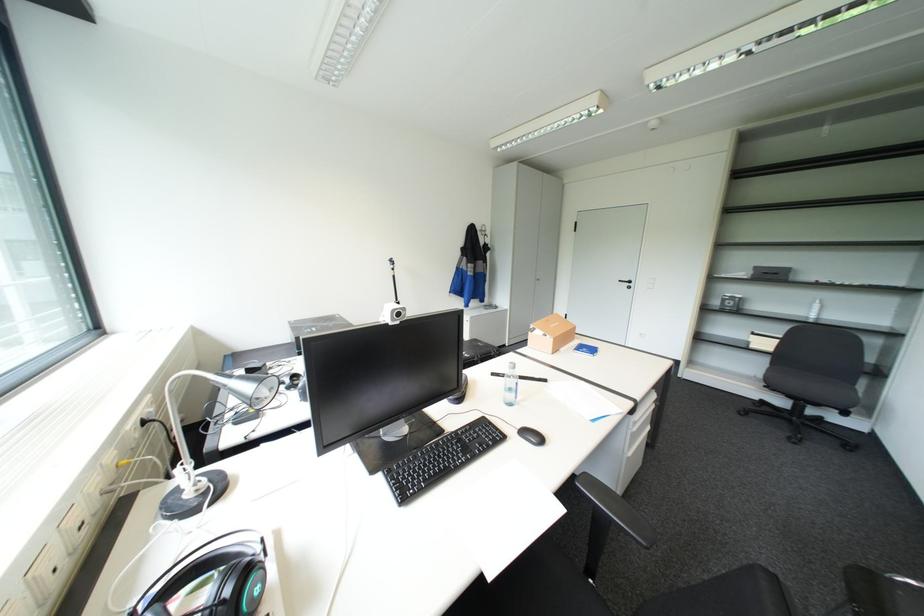
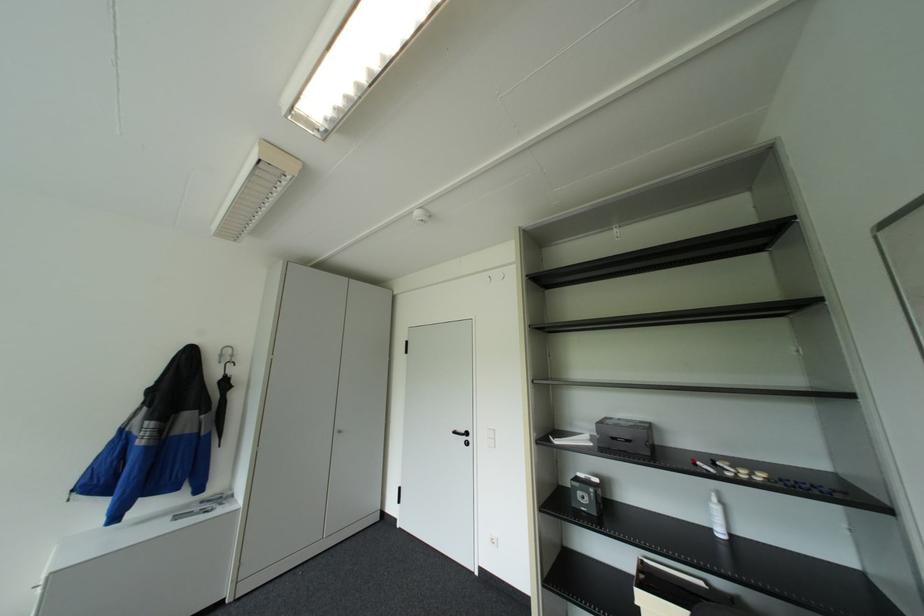
Locate, in the second image, the point that corresponds to point 491,233 in the first image.

(227, 361)